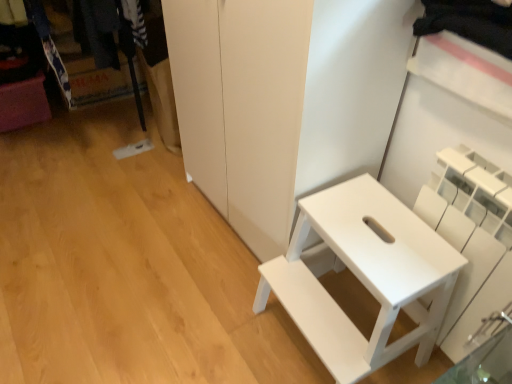
Question: Considering the relative sizes of white matte step stool at right and white matte shelf at right in the image provided, is white matte step stool at right wider than white matte shelf at right?

Choices:
 (A) no
 (B) yes

Answer: (B)

Question: Can you confirm if white matte step stool at right is thinner than white matte shelf at right?

Choices:
 (A) yes
 (B) no

Answer: (B)

Question: From the image's perspective, is white matte step stool at right under white matte shelf at right?

Choices:
 (A) yes
 (B) no

Answer: (A)

Question: Is white matte step stool at right aimed at white matte shelf at right?

Choices:
 (A) no
 (B) yes

Answer: (A)

Question: Does white matte step stool at right appear on the left side of white matte shelf at right?

Choices:
 (A) yes
 (B) no

Answer: (A)

Question: Does white matte step stool at right have a greater height compared to white matte shelf at right?

Choices:
 (A) yes
 (B) no

Answer: (B)

Question: Does white matte shelf at right have a larger size compared to white matte step stool at right?

Choices:
 (A) no
 (B) yes

Answer: (A)

Question: Can you confirm if white matte shelf at right is shorter than white matte step stool at right?

Choices:
 (A) yes
 (B) no

Answer: (B)

Question: Does white matte shelf at right come in front of white matte step stool at right?

Choices:
 (A) no
 (B) yes

Answer: (B)

Question: Is white matte shelf at right oriented away from white matte step stool at right?

Choices:
 (A) no
 (B) yes

Answer: (A)

Question: Is white matte shelf at right surrounding white matte step stool at right?

Choices:
 (A) no
 (B) yes

Answer: (A)

Question: Considering the relative sizes of white matte shelf at right and white matte step stool at right in the image provided, is white matte shelf at right wider than white matte step stool at right?

Choices:
 (A) no
 (B) yes

Answer: (A)

Question: Based on their sizes in the image, would you say white matte shelf at right is bigger or smaller than white matte step stool at right?

Choices:
 (A) small
 (B) big

Answer: (A)